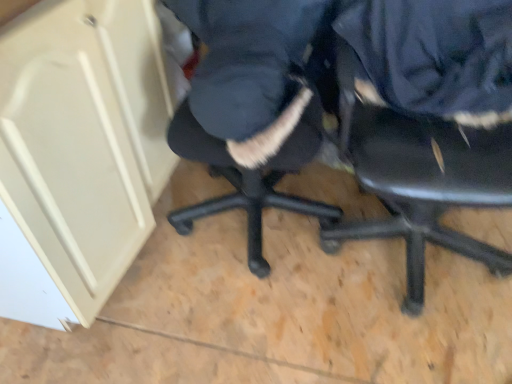
At what (x,y) coordinates should I click in order to perform the action: click on beige matte cabinet at upper left. Please return your answer as a coordinate pair (x, y). Looking at the image, I should click on (78, 153).

Find the location of a particular element. navy blue fabric at upper right, which ranks as the first clothing in right-to-left order is located at coordinates (434, 56).

Image resolution: width=512 pixels, height=384 pixels. Describe the element at coordinates (434, 56) in the screenshot. I see `navy blue fabric at upper right, the 2th clothing from the left` at that location.

The image size is (512, 384). I want to click on navy blue fabric at center, the second clothing from the right, so click(x=247, y=81).

In the scene shown: From a real-world perspective, is black plastic chair at center on top of beige matte cabinet at upper left?

Incorrect, from a real-world perspective, black plastic chair at center is lower than beige matte cabinet at upper left.

Which is in front, black plastic chair at center or beige matte cabinet at upper left?

black plastic chair at center.

Can you tell me how much black plastic chair at center and beige matte cabinet at upper left differ in facing direction?

There is a 84.1-degree angle between the facing directions of black plastic chair at center and beige matte cabinet at upper left.

Locate an element on the screen. chair located underneath the beige matte cabinet at upper left (from a real-world perspective) is located at coordinates (419, 179).

Is navy blue fabric at center, the 1th clothing in the left-to-right sequence, looking in the opposite direction of black plastic chair at center?

No, navy blue fabric at center, the 1th clothing in the left-to-right sequence,'s orientation is not away from black plastic chair at center.

Is point (170, 6) less distant than point (479, 254)?

Yes, point (170, 6) is closer to viewer.

Which object is thinner, navy blue fabric at center, the 1th clothing in the left-to-right sequence, or black plastic chair at center?

navy blue fabric at center, the 1th clothing in the left-to-right sequence.

Between navy blue fabric at center, the 1th clothing in the left-to-right sequence, and black plastic chair at center, which one is positioned behind?

Answer: navy blue fabric at center, the 1th clothing in the left-to-right sequence, is behind.

How different are the orientations of beige matte cabinet at upper left and navy blue fabric at upper right, which ranks as the first clothing in right-to-left order, in degrees?

The angular difference between beige matte cabinet at upper left and navy blue fabric at upper right, which ranks as the first clothing in right-to-left order, is 84.1 degrees.

Considering the relative sizes of beige matte cabinet at upper left and navy blue fabric at upper right, which ranks as the first clothing in right-to-left order, in the image provided, is beige matte cabinet at upper left wider than navy blue fabric at upper right, which ranks as the first clothing in right-to-left order,?

Yes.

In the image, is beige matte cabinet at upper left positioned in front of or behind navy blue fabric at upper right, which ranks as the first clothing in right-to-left order?

Visually, beige matte cabinet at upper left is located in front of navy blue fabric at upper right, which ranks as the first clothing in right-to-left order.

Is beige matte cabinet at upper left with navy blue fabric at upper right, the 2th clothing from the left?

No, beige matte cabinet at upper left is not in contact with navy blue fabric at upper right, the 2th clothing from the left.

From the image's perspective, between black plastic chair at center and navy blue fabric at center, the second clothing from the right, which one is located above?

navy blue fabric at center, the second clothing from the right.

From a real-world perspective, is black plastic chair at center on top of navy blue fabric at center, the second clothing from the right?

No.

Does black plastic chair at center have a lesser height compared to navy blue fabric at center, the second clothing from the right?

In fact, black plastic chair at center may be taller than navy blue fabric at center, the second clothing from the right.

Considering the relative positions of beige matte cabinet at upper left and black plastic chair at center in the image provided, is beige matte cabinet at upper left in front of black plastic chair at center?

No, beige matte cabinet at upper left is further to the viewer.

Considering the sizes of beige matte cabinet at upper left and black plastic chair at center in the image, is beige matte cabinet at upper left bigger or smaller than black plastic chair at center?

Clearly, beige matte cabinet at upper left is larger in size than black plastic chair at center.

Locate an element on the screen. The width and height of the screenshot is (512, 384). chair to the right of beige matte cabinet at upper left is located at coordinates (419, 179).

Are beige matte cabinet at upper left and navy blue fabric at center, the 1th clothing in the left-to-right sequence, beside each other?

No, beige matte cabinet at upper left is not making contact with navy blue fabric at center, the 1th clothing in the left-to-right sequence.

In the image, is beige matte cabinet at upper left positioned in front of or behind navy blue fabric at center, the second clothing from the right?

beige matte cabinet at upper left is in front of navy blue fabric at center, the second clothing from the right.

Can you tell me how much beige matte cabinet at upper left and navy blue fabric at center, the second clothing from the right, differ in facing direction?

86.9 degrees.

Does beige matte cabinet at upper left appear on the right side of navy blue fabric at center, the second clothing from the right?

In fact, beige matte cabinet at upper left is to the left of navy blue fabric at center, the second clothing from the right.

Is navy blue fabric at center, the second clothing from the right, at the back of navy blue fabric at upper right, which ranks as the first clothing in right-to-left order?

No, navy blue fabric at upper right, which ranks as the first clothing in right-to-left order, is not facing the opposite direction of navy blue fabric at center, the second clothing from the right.

Is navy blue fabric at upper right, the 2th clothing from the left, bigger than navy blue fabric at center, the second clothing from the right?

No.

Would you say navy blue fabric at upper right, which ranks as the first clothing in right-to-left order, is outside navy blue fabric at center, the second clothing from the right?

That's correct, navy blue fabric at upper right, which ranks as the first clothing in right-to-left order, is outside of navy blue fabric at center, the second clothing from the right.

Is navy blue fabric at upper right, which ranks as the first clothing in right-to-left order, wider than navy blue fabric at center, the second clothing from the right?

No.

What are the coordinates of `cabinetry above the black plastic chair at center (from the image's perspective)` in the screenshot? It's located at (78, 153).

You are a GUI agent. You are given a task and a screenshot of the screen. Output one action in this format:
    pyautogui.click(x=<x>, y=<y>)
    Task: Click on the chair on the right side of navy blue fabric at center, the second clothing from the right
    The height and width of the screenshot is (384, 512).
    Given the screenshot: What is the action you would take?
    click(419, 179)

Estimate the real-world distances between objects in this image. Which object is closer to navy blue fabric at upper right, the 2th clothing from the left, beige matte cabinet at upper left or black plastic chair at center?

black plastic chair at center is positioned closer to the anchor navy blue fabric at upper right, the 2th clothing from the left.

Based on the photo, based on their spatial positions, is navy blue fabric at upper right, which ranks as the first clothing in right-to-left order, or black plastic chair at center further from beige matte cabinet at upper left?

navy blue fabric at upper right, which ranks as the first clothing in right-to-left order, is further to beige matte cabinet at upper left.

Which object lies further to the anchor point beige matte cabinet at upper left, navy blue fabric at center, the second clothing from the right, or navy blue fabric at upper right, the 2th clothing from the left?

navy blue fabric at upper right, the 2th clothing from the left, is positioned further to the anchor beige matte cabinet at upper left.

Considering their positions, is navy blue fabric at upper right, which ranks as the first clothing in right-to-left order, positioned closer to navy blue fabric at center, the 1th clothing in the left-to-right sequence, than beige matte cabinet at upper left?

navy blue fabric at upper right, which ranks as the first clothing in right-to-left order.

Which object lies further to the anchor point navy blue fabric at center, the 1th clothing in the left-to-right sequence, beige matte cabinet at upper left or black plastic chair at center?

beige matte cabinet at upper left lies further to navy blue fabric at center, the 1th clothing in the left-to-right sequence, than the other object.

Looking at this image, considering their positions, is navy blue fabric at center, the second clothing from the right, positioned further to black plastic chair at center than navy blue fabric at upper right, which ranks as the first clothing in right-to-left order?

The object further to black plastic chair at center is navy blue fabric at center, the second clothing from the right.

Looking at the image, which one is located closer to beige matte cabinet at upper left, navy blue fabric at upper right, which ranks as the first clothing in right-to-left order, or navy blue fabric at center, the second clothing from the right?

navy blue fabric at center, the second clothing from the right, is positioned closer to the anchor beige matte cabinet at upper left.

Estimate the real-world distances between objects in this image. Which object is closer to navy blue fabric at center, the second clothing from the right, black plastic chair at center or beige matte cabinet at upper left?

Based on the image, black plastic chair at center appears to be nearer to navy blue fabric at center, the second clothing from the right.

In order to click on clothing located between beige matte cabinet at upper left and navy blue fabric at upper right, the 2th clothing from the left, in the left-right direction in this screenshot , I will do `click(247, 81)`.

I want to click on clothing located between navy blue fabric at center, the second clothing from the right, and black plastic chair at center in the left-right direction, so click(x=434, y=56).